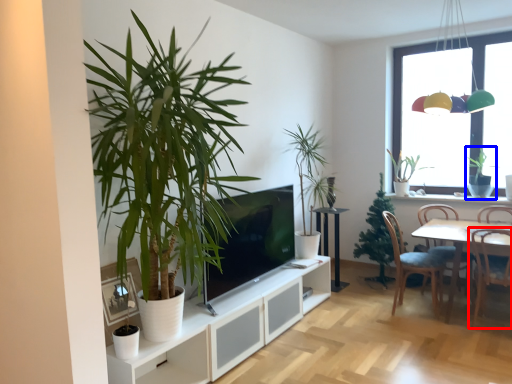
Question: Which object appears closest to the camera in this image, chair (highlighted by a red box) or houseplant (highlighted by a blue box)?

Choices:
 (A) chair
 (B) houseplant

Answer: (A)